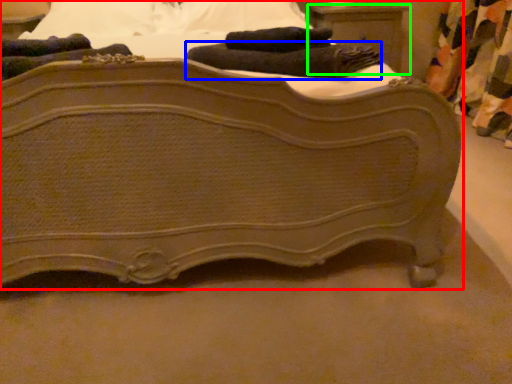
Question: Estimate the real-world distances between objects in this image. Which object is closer to bed (highlighted by a red box), bath towel (highlighted by a blue box) or nightstand (highlighted by a green box)?

Choices:
 (A) bath towel
 (B) nightstand

Answer: (A)